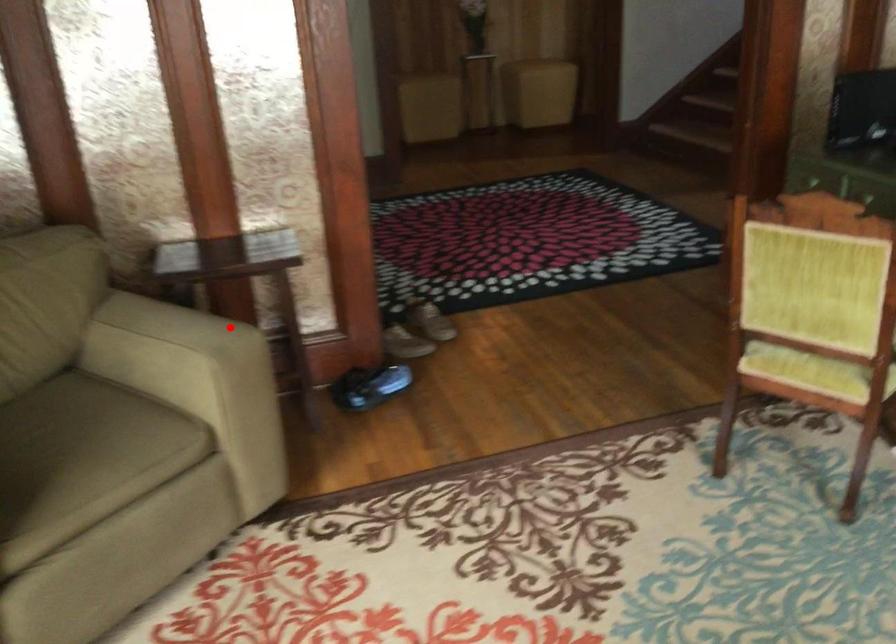
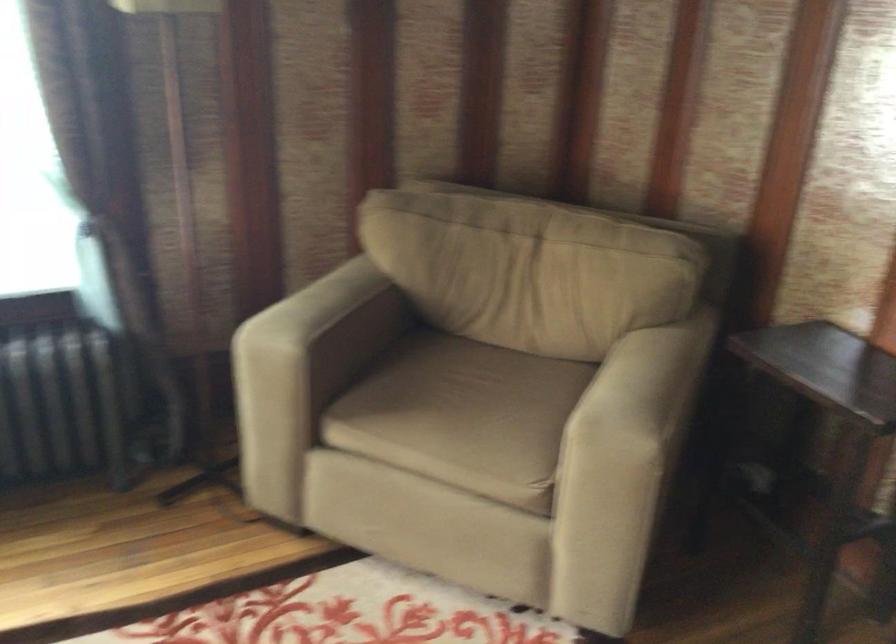
Where in the second image is the point corresponding to the highlighted location from the first image?

(640, 413)